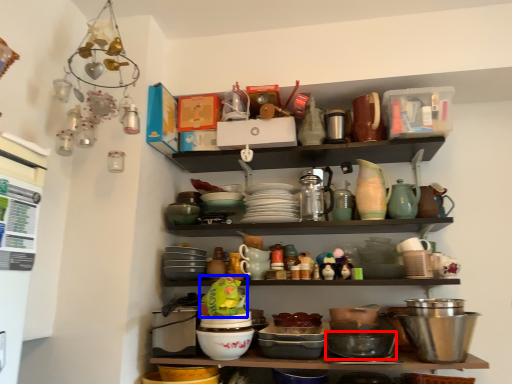
Question: Which of the following is the farthest to the observer, bowl (highlighted by a red box) or food (highlighted by a blue box)?

Choices:
 (A) bowl
 (B) food

Answer: (A)